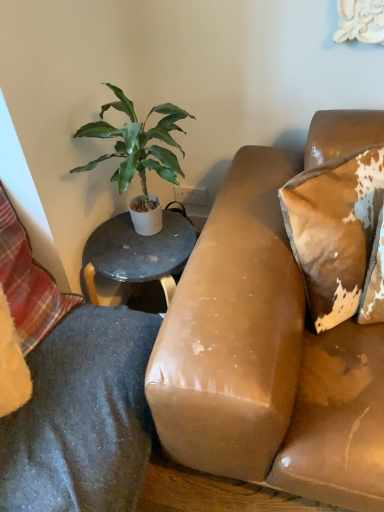
Question: Considering the positions of green leafy plant at upper left and plaid fabric pillow at lower left, placed as the second pillow when sorted from right to left, in the image, is green leafy plant at upper left bigger or smaller than plaid fabric pillow at lower left, placed as the second pillow when sorted from right to left,?

Choices:
 (A) big
 (B) small

Answer: (A)

Question: Based on their positions, is green leafy plant at upper left located to the left or right of plaid fabric pillow at lower left, the 1th pillow viewed from the left?

Choices:
 (A) left
 (B) right

Answer: (B)

Question: Based on their relative distances, which object is farther from the plaid fabric pillow at lower left, the 1th pillow viewed from the left?

Choices:
 (A) green leafy plant at upper left
 (B) brown distressed leather pillow at upper right, placed as the 2th pillow when sorted from left to right

Answer: (B)

Question: Estimate the real-world distances between objects in this image. Which object is farther from the green leafy plant at upper left?

Choices:
 (A) plaid fabric pillow at lower left, placed as the second pillow when sorted from right to left
 (B) brown distressed leather pillow at upper right, positioned as the first pillow in right-to-left order

Answer: (B)